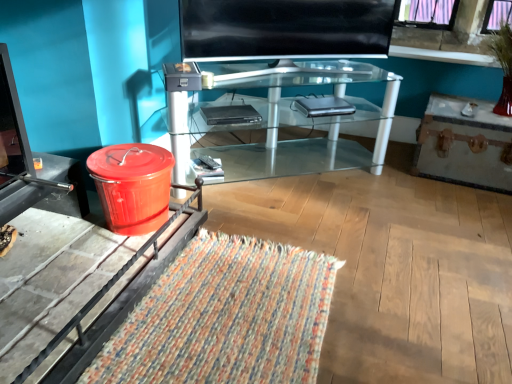
Where is `blank space situated above black plastic dvd player at center, positioned as the second laptop in right-to-left order (from a real-world perspective)`? blank space situated above black plastic dvd player at center, positioned as the second laptop in right-to-left order (from a real-world perspective) is located at coordinates (233, 109).